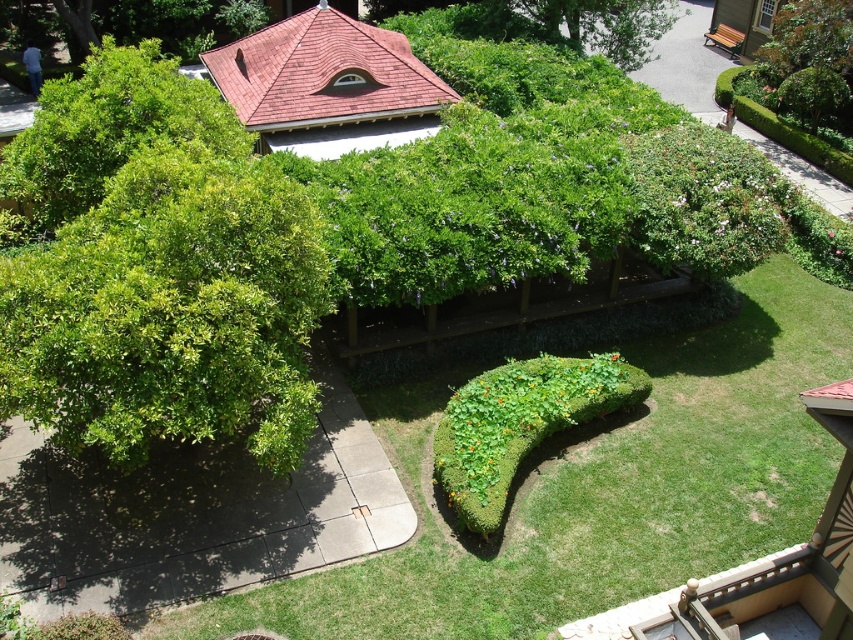
Looking at this image, you are designing a garden layout and need to place a 2m wide statue between the green leafy bush at upper left and the green leafy bush at upper right. Based on their widths, which bush will require more space to accommodate the statue?

The green leafy bush at upper left requires more space because its width surpasses that of the green leafy bush at upper right.

You are a gardener planning to water the green leafy bush at upper right and the green leafy bush at upper center. Which bush is closer to the ground? Please answer based on their positions relative to each other.

The green leafy bush at upper right is positioned under the green leafy bush at upper center, meaning it is closer to the ground.